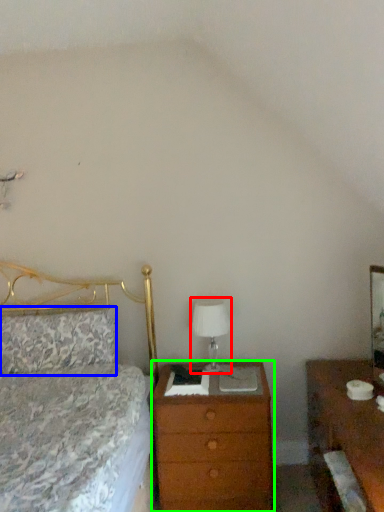
Question: Which is nearer to the table lamp (highlighted by a red box)? pillow (highlighted by a blue box) or chest of drawers (highlighted by a green box).

Choices:
 (A) pillow
 (B) chest of drawers

Answer: (B)